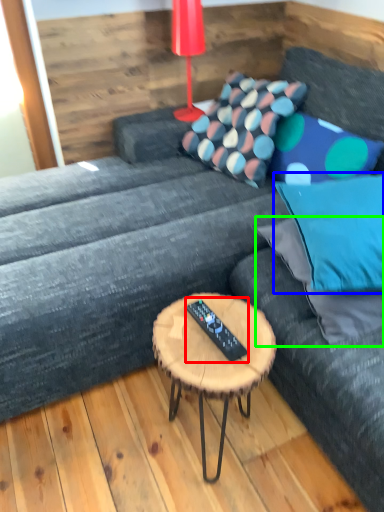
Question: Which object is positioned closest to remote (highlighted by a red box)? Select from pillow (highlighted by a blue box) and pillow (highlighted by a green box).

Choices:
 (A) pillow
 (B) pillow

Answer: (B)